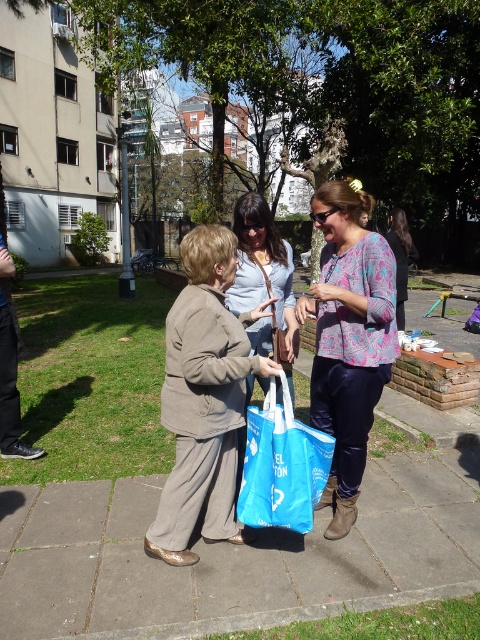
Consider the image. Who is more forward, (115, 554) or (212, 444)?

Point (212, 444)

Which of these two, smooth concrete pavement at center or matte brown jacket at center, stands taller?

With more height is matte brown jacket at center.

Which is in front, point (69, 536) or point (189, 291)?

Point (189, 291)

At what (x,y) coordinates should I click in order to perform the action: click on smooth concrete pavement at center. Please return your answer as a coordinate pair (x, y). This screenshot has height=640, width=480. Looking at the image, I should click on (232, 557).

Can you confirm if floral print blouse at center is positioned below light blue cotton shirt at center?

Yes, floral print blouse at center is below light blue cotton shirt at center.

Measure the distance between floral print blouse at center and camera.

floral print blouse at center is 8.59 feet from camera.

The height and width of the screenshot is (640, 480). I want to click on floral print blouse at center, so click(348, 339).

Does light blue cotton shirt at center have a lesser width compared to patterned fabric shirt at center?

Correct, light blue cotton shirt at center's width is less than patterned fabric shirt at center's.

Is point (235, 214) farther from viewer compared to point (410, 246)?

No.

This screenshot has width=480, height=640. Find the location of `light blue cotton shirt at center`. light blue cotton shirt at center is located at coordinates (263, 275).

Image resolution: width=480 pixels, height=640 pixels. Find the location of `light blue cotton shirt at center`. light blue cotton shirt at center is located at coordinates (263, 275).